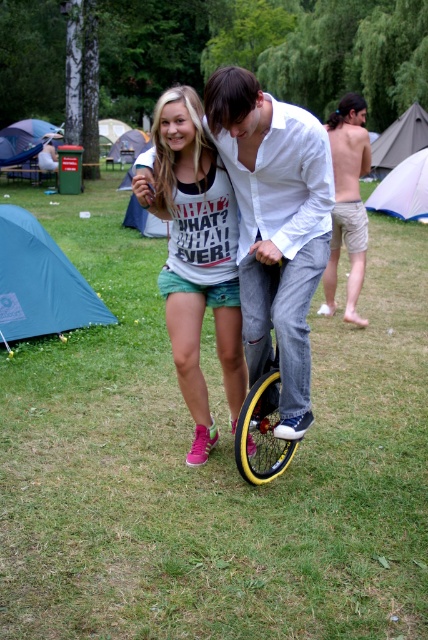
Who is more distant from viewer, [47,253] or [252,468]?

The point [47,253] is more distant.

Which is more to the left, blue fabric tent at lower left or yellow rubber wheel at center?

Positioned to the left is blue fabric tent at lower left.

Find the location of a particular element. The height and width of the screenshot is (640, 428). blue fabric tent at lower left is located at coordinates pyautogui.click(x=39, y=282).

Between point (336, 244) and point (290, 456), which one is positioned behind?

Positioned behind is point (336, 244).

In the scene shown: Is tan shorts at center thinner than yellow rubber monocycle at center?

Yes, tan shorts at center is thinner than yellow rubber monocycle at center.

Is point (338, 209) positioned before point (264, 396)?

No, it is behind (264, 396).

I want to click on tan shorts at center, so coord(347,202).

Is point (252, 397) less distant than point (128, 136)?

That is True.

Who is lower down, yellow rubber monocycle at center or blue tarpaulin tent at upper left?

Positioned lower is yellow rubber monocycle at center.

Find the location of a particular element. The image size is (428, 640). yellow rubber monocycle at center is located at coordinates (261, 422).